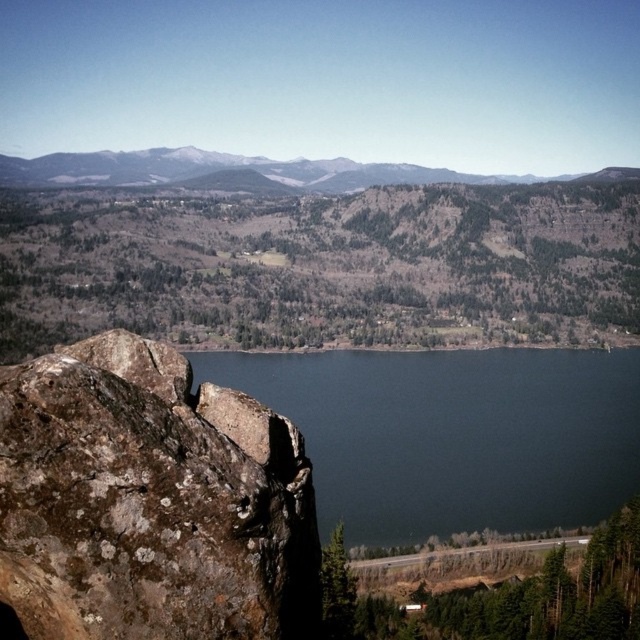
Question: Does dark blue water at center appear on the right side of snowy rocky mountain at upper center?

Choices:
 (A) no
 (B) yes

Answer: (B)

Question: Is brown rough rock at left further to camera compared to snowy rocky mountain at upper center?

Choices:
 (A) yes
 (B) no

Answer: (B)

Question: Does brown rough rock at left have a greater width compared to snowy rocky mountain at upper center?

Choices:
 (A) yes
 (B) no

Answer: (B)

Question: Which point appears closest to the camera in this image?

Choices:
 (A) (205, 164)
 (B) (179, 378)

Answer: (B)

Question: Which point is farther from the camera taking this photo?

Choices:
 (A) (284, 173)
 (B) (241, 596)

Answer: (A)

Question: Which point is farther from the camera taking this photo?

Choices:
 (A) (545, 413)
 (B) (308, 502)
 (C) (451, 172)

Answer: (C)